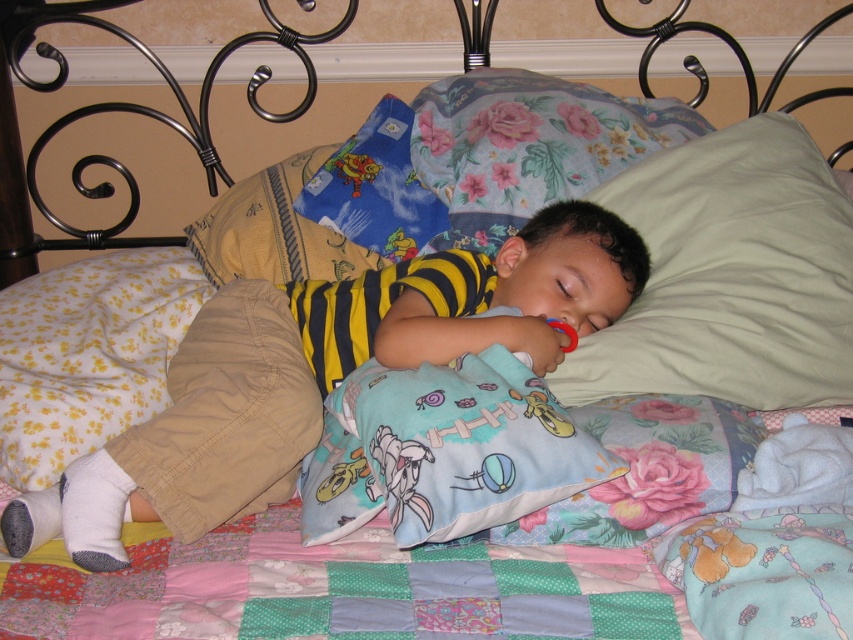
Who is lower down, black wrought iron headboard at upper center or patchwork quilt at center?

patchwork quilt at center is lower down.

Does point (221, 144) come in front of point (378, 524)?

No, (221, 144) is further to viewer.

Where is `black wrought iron headboard at upper center`? Image resolution: width=853 pixels, height=640 pixels. black wrought iron headboard at upper center is located at coordinates (329, 81).

Who is more forward, (302, 593) or (650, 148)?

Point (302, 593) is in front.

Can you confirm if patchwork quilt at center is positioned above floral fabric pillow at upper center?

No, patchwork quilt at center is not above floral fabric pillow at upper center.

Does point (42, 568) come behind point (512, 76)?

No.

This screenshot has width=853, height=640. What are the coordinates of `patchwork quilt at center` in the screenshot? It's located at (339, 588).

Is point (630, 621) less distant than point (437, 419)?

Yes.

Between patchwork quilt at center and light blue flannel pillow at center, which one is positioned lower?

patchwork quilt at center

This screenshot has height=640, width=853. Find the location of `patchwork quilt at center`. patchwork quilt at center is located at coordinates (339, 588).